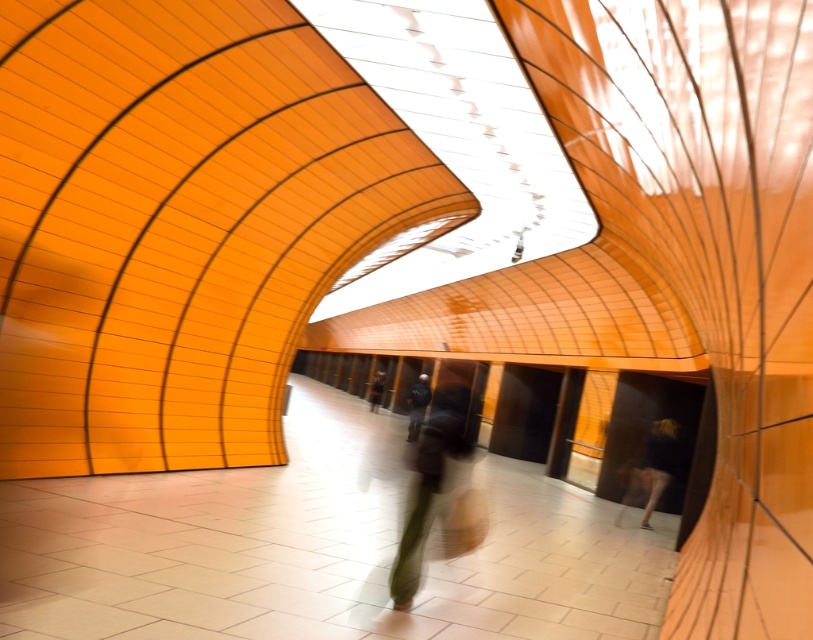
Question: Which object is farther from the camera taking this photo?

Choices:
 (A) dark blue jeans at center
 (B) dark blue fabric at lower right
 (C) dark gray fabric bag at center
 (D) dark blue jacket at center

Answer: (A)

Question: Where is dark gray fabric bag at center located in relation to dark blue jacket at center in the image?

Choices:
 (A) left
 (B) right

Answer: (B)

Question: Which object is the closest to the dark blue jeans at center?

Choices:
 (A) dark blue fabric at lower right
 (B) dark gray fabric bag at center
 (C) dark blue jacket at center

Answer: (B)

Question: Which point is closer to the camera taking this photo?

Choices:
 (A) (381, 387)
 (B) (420, 381)
 (C) (393, 561)
 (D) (672, 456)

Answer: (C)

Question: Does dark blue jacket at center appear over dark blue jeans at center?

Choices:
 (A) yes
 (B) no

Answer: (A)

Question: Does dark gray fabric bag at center appear on the right side of dark blue jacket at center?

Choices:
 (A) yes
 (B) no

Answer: (A)